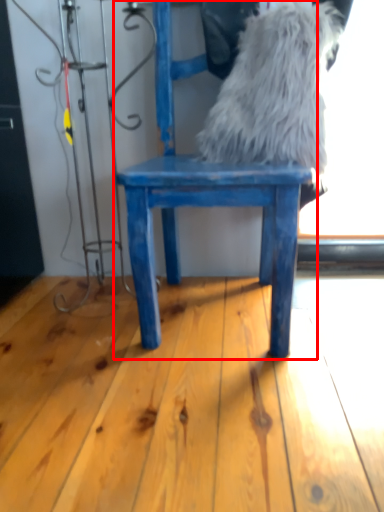
Question: From the image's perspective, where is chair (annotated by the red box) located relative to animal?

Choices:
 (A) below
 (B) above

Answer: (A)